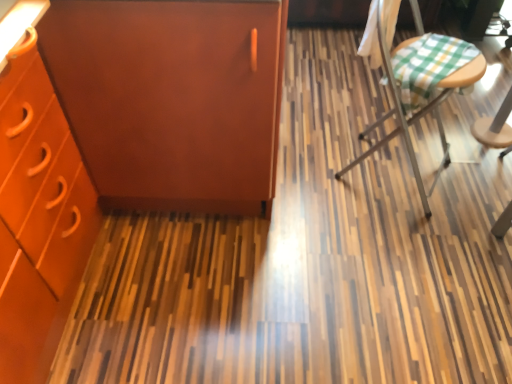
Question: Are matte orange cabinet at upper left and matte brown cabinet at left beside each other?

Choices:
 (A) yes
 (B) no

Answer: (A)

Question: From a real-world perspective, is matte orange cabinet at upper left physically above matte brown cabinet at left?

Choices:
 (A) no
 (B) yes

Answer: (B)

Question: From the image's perspective, does matte orange cabinet at upper left appear lower than matte brown cabinet at left?

Choices:
 (A) yes
 (B) no

Answer: (A)

Question: Is matte orange cabinet at upper left looking in the opposite direction of matte brown cabinet at left?

Choices:
 (A) no
 (B) yes

Answer: (B)

Question: Is matte orange cabinet at upper left oriented towards matte brown cabinet at left?

Choices:
 (A) yes
 (B) no

Answer: (B)

Question: Looking at the image, does green checkered fabric at right seem bigger or smaller compared to matte brown cabinet at left?

Choices:
 (A) small
 (B) big

Answer: (A)

Question: Is green checkered fabric at right in front of or behind matte brown cabinet at left in the image?

Choices:
 (A) behind
 (B) front

Answer: (A)

Question: From a real-world perspective, relative to matte brown cabinet at left, is green checkered fabric at right vertically above or below?

Choices:
 (A) above
 (B) below

Answer: (B)

Question: Is point (391, 132) positioned closer to the camera than point (140, 185)?

Choices:
 (A) farther
 (B) closer

Answer: (A)

Question: Do you think matte orange cabinet at upper left is within green checkered fabric at right, or outside of it?

Choices:
 (A) outside
 (B) inside

Answer: (A)

Question: Would you say matte orange cabinet at upper left is to the left or to the right of green checkered fabric at right in the picture?

Choices:
 (A) right
 (B) left

Answer: (B)

Question: Does point (218, 89) appear closer or farther from the camera than point (388, 49)?

Choices:
 (A) farther
 (B) closer

Answer: (B)

Question: From their relative heights in the image, would you say matte orange cabinet at upper left is taller or shorter than green checkered fabric at right?

Choices:
 (A) short
 (B) tall

Answer: (B)

Question: From a real-world perspective, relative to matte orange cabinet at upper left, is green checkered fabric at right vertically above or below?

Choices:
 (A) above
 (B) below

Answer: (B)

Question: Is green checkered fabric at right inside the boundaries of matte orange cabinet at upper left, or outside?

Choices:
 (A) inside
 (B) outside

Answer: (B)